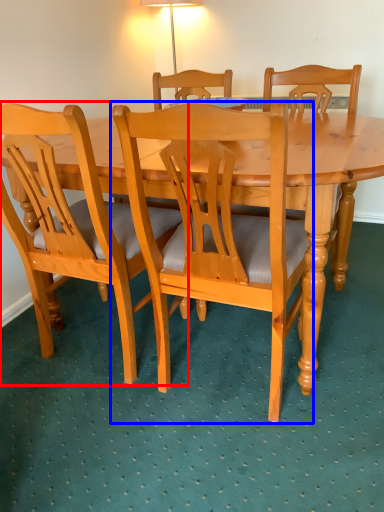
Question: Which point is closer to the camera, chair (highlighted by a red box) or chair (highlighted by a blue box)?

Choices:
 (A) chair
 (B) chair

Answer: (B)